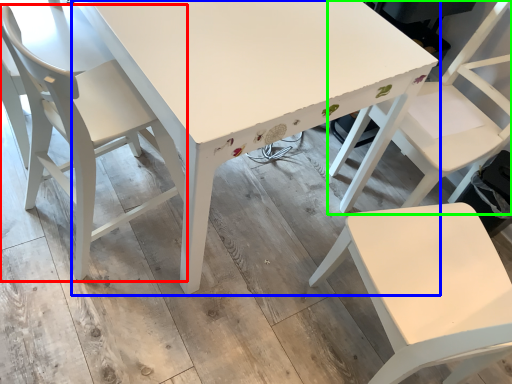
Question: Estimate the real-world distances between objects in this image. Which object is closer to chair (highlighted by a red box), table (highlighted by a blue box) or chair (highlighted by a green box)?

Choices:
 (A) table
 (B) chair

Answer: (A)